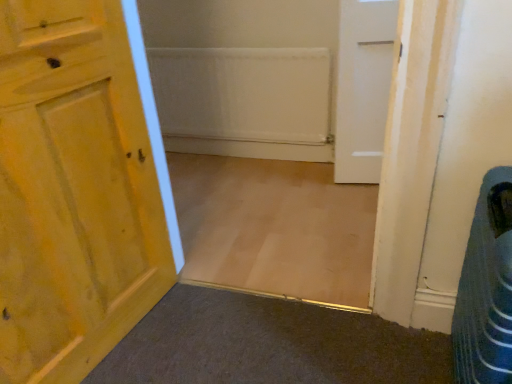
Question: Is wooden door at left, the 2th door in the back-to-front sequence, spatially inside white matte door at upper right, positioned as the 2th door in left-to-right order, or outside of it?

Choices:
 (A) outside
 (B) inside

Answer: (A)

Question: Looking at the image, does wooden door at left, the 2th door in the back-to-front sequence, seem bigger or smaller compared to white matte door at upper right, positioned as the 2th door in left-to-right order?

Choices:
 (A) big
 (B) small

Answer: (A)

Question: Which object is positioned farthest from the wooden door at left, the 2th door in the back-to-front sequence?

Choices:
 (A) blue striped fabric laundry basket at lower right
 (B) white matte door at upper right, positioned as the 1th door in back-to-front order

Answer: (B)

Question: Based on their relative distances, which object is farther from the wooden door at left, which is counted as the 1th door, starting from the left?

Choices:
 (A) blue striped fabric laundry basket at lower right
 (B) white matte door at upper right, which is the second door in front-to-back order

Answer: (B)